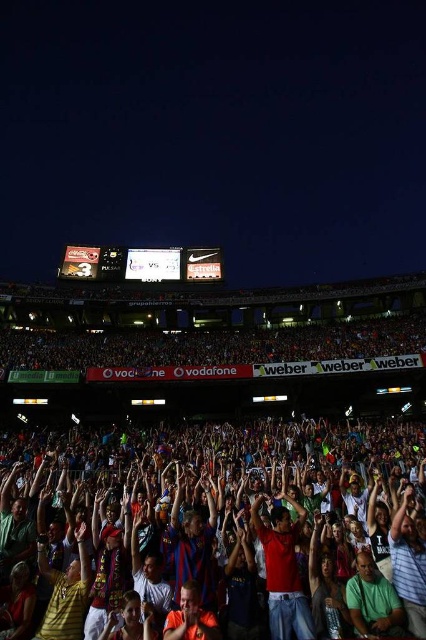
Can you confirm if multicolored fabric crowd at lower center is positioned to the left of red cotton shirt at center?

Correct, you'll find multicolored fabric crowd at lower center to the left of red cotton shirt at center.

Between multicolored fabric crowd at lower center and red cotton shirt at center, which one has less height?

red cotton shirt at center

Does point (72, 520) lie behind point (299, 579)?

Yes.

The width and height of the screenshot is (426, 640). I want to click on multicolored fabric crowd at lower center, so click(233, 552).